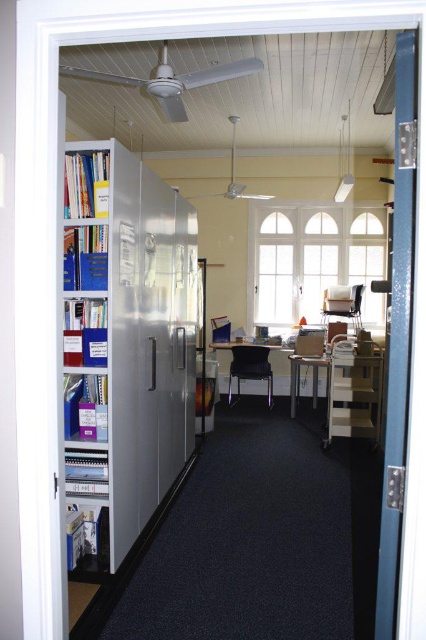
Who is shorter, metallic gray bookcase at left or teal glossy door at right?

With less height is teal glossy door at right.

Locate an element on the screen. Image resolution: width=426 pixels, height=640 pixels. metallic gray bookcase at left is located at coordinates (124, 340).

What do you see at coordinates (124, 340) in the screenshot? I see `metallic gray bookcase at left` at bounding box center [124, 340].

At what (x,y) coordinates should I click in order to perform the action: click on metallic gray bookcase at left. Please return your answer as a coordinate pair (x, y). This screenshot has width=426, height=640. Looking at the image, I should click on (124, 340).